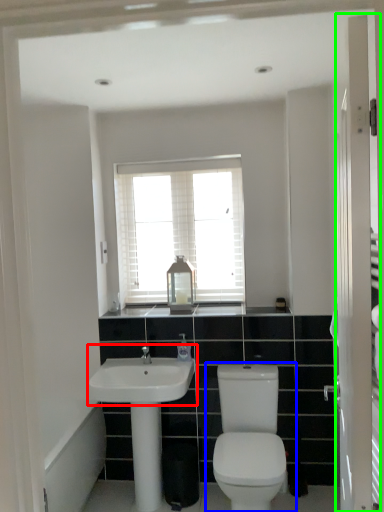
Question: Based on their relative distances, which object is nearer to sink (highlighted by a red box)? Choose from toilet (highlighted by a blue box) and screen door (highlighted by a green box).

Choices:
 (A) toilet
 (B) screen door

Answer: (A)